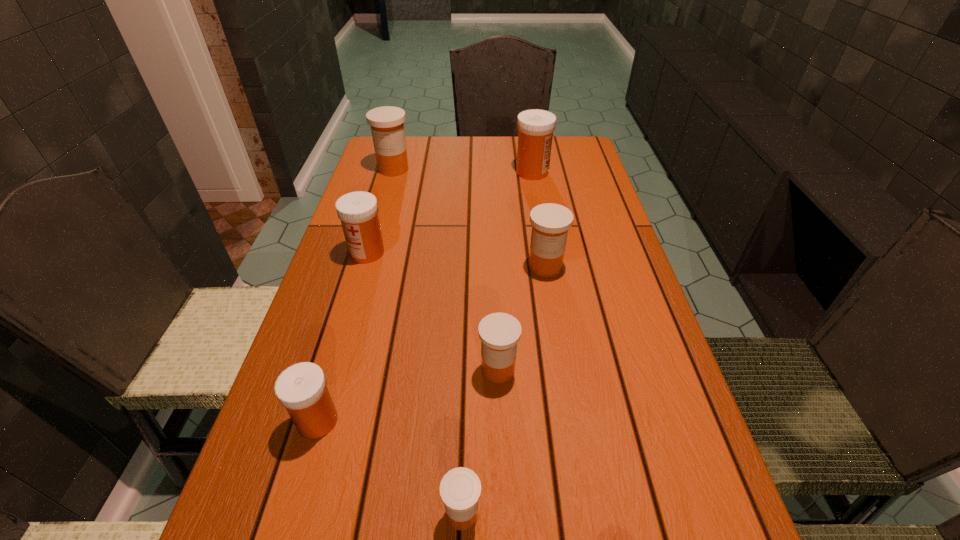
Locate an element on the screen. The width and height of the screenshot is (960, 540). blank area located on the right of the second nearest object is located at coordinates (447, 421).

Find the location of a particular element. The height and width of the screenshot is (540, 960). vacant space positioned on the label of the nearest medicine is located at coordinates (608, 513).

Identify the location of object that is at the far left corner. (386, 122).

This screenshot has height=540, width=960. Find the location of `object at the far right corner`. object at the far right corner is located at coordinates (535, 127).

Image resolution: width=960 pixels, height=540 pixels. In the image, there is a desktop. Find the location of `vacant space at the far edge`. vacant space at the far edge is located at coordinates (485, 143).

Locate an element on the screen. The image size is (960, 540). vacant space at the left edge is located at coordinates (344, 469).

The width and height of the screenshot is (960, 540). What are the coordinates of `vacant space at the right edge` in the screenshot? It's located at (590, 234).

I want to click on vacant area at the far left corner, so click(x=375, y=152).

The height and width of the screenshot is (540, 960). I want to click on vacant point at the far right corner, so click(x=569, y=160).

Locate an element on the screen. vacant space that is in between the nearest white medicine and the biggest orange medicine is located at coordinates (355, 295).